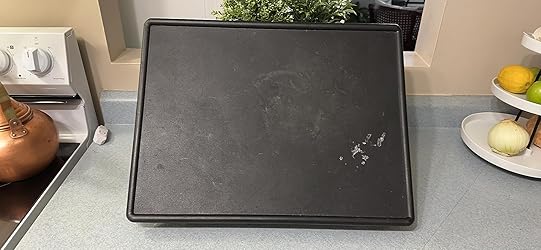
Find the location of a particular element. This screenshot has width=541, height=250. window shade is located at coordinates pos(138,9).